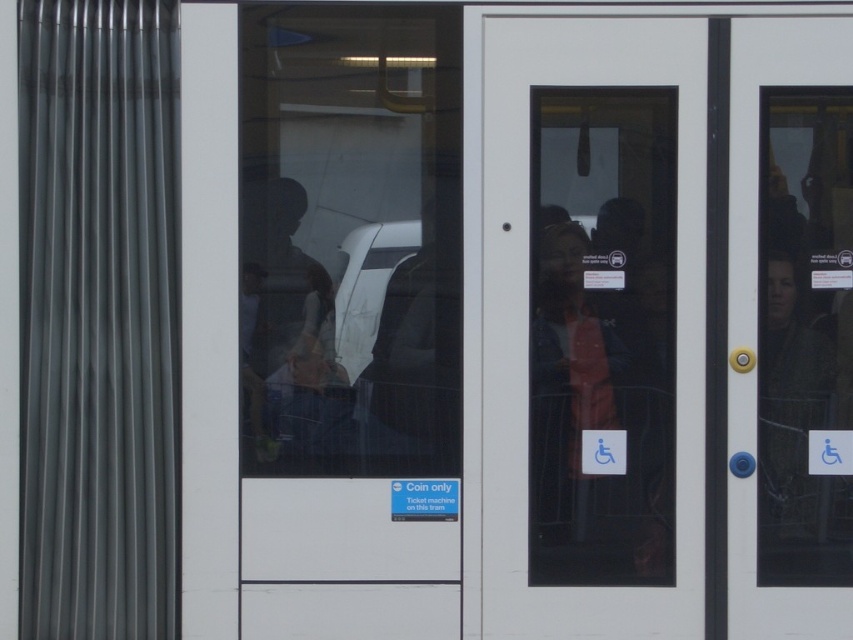
In the scene shown: You are a passenger standing at the center of the train. You notice a white glossy door at center and a matte black jacket at center. Which object is taller?

The white glossy door at center is taller than the matte black jacket at center.

You are a passenger waiting at the train station. You see the white glossy door at center and the matte black jacket at center in the image. Which object is positioned higher from the ground?

The white glossy door at center is located above the matte black jacket at center, so it is positioned higher from the ground.

You are a passenger standing on the platform waiting for the train to arrive. When the train stops, you notice the white glossy door at center and the matte black jacket at center. Which object is closer to you?

The white glossy door at center is closer to you because it is in front of the matte black jacket at center.